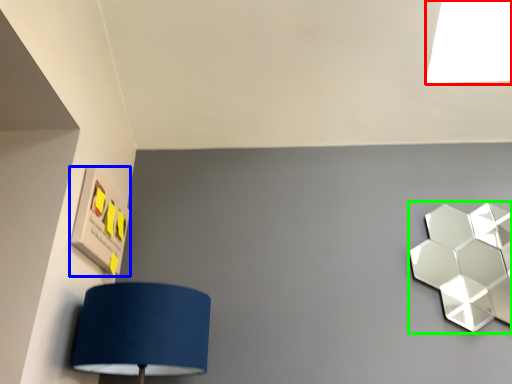
Question: Which object is positioned farthest from light (highlighted by a red box)? Select from square (highlighted by a blue box) and lamp (highlighted by a green box).

Choices:
 (A) square
 (B) lamp

Answer: (A)